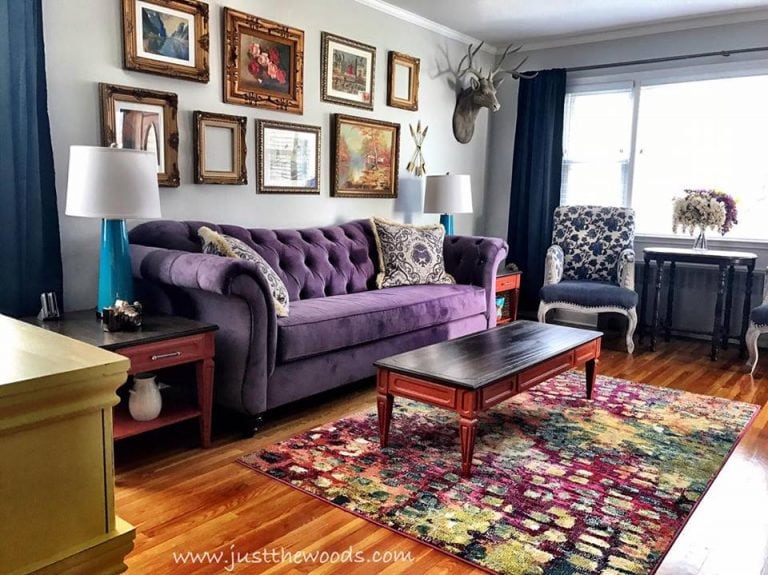
You are a GUI agent. You are given a task and a screenshot of the screen. Output one action in this format:
    pyautogui.click(x=<x>, y=<y>)
    Task: Click on the blue glazed lamps
    This screenshot has height=575, width=768.
    Given the screenshot: What is the action you would take?
    pyautogui.click(x=117, y=260), pyautogui.click(x=449, y=224)